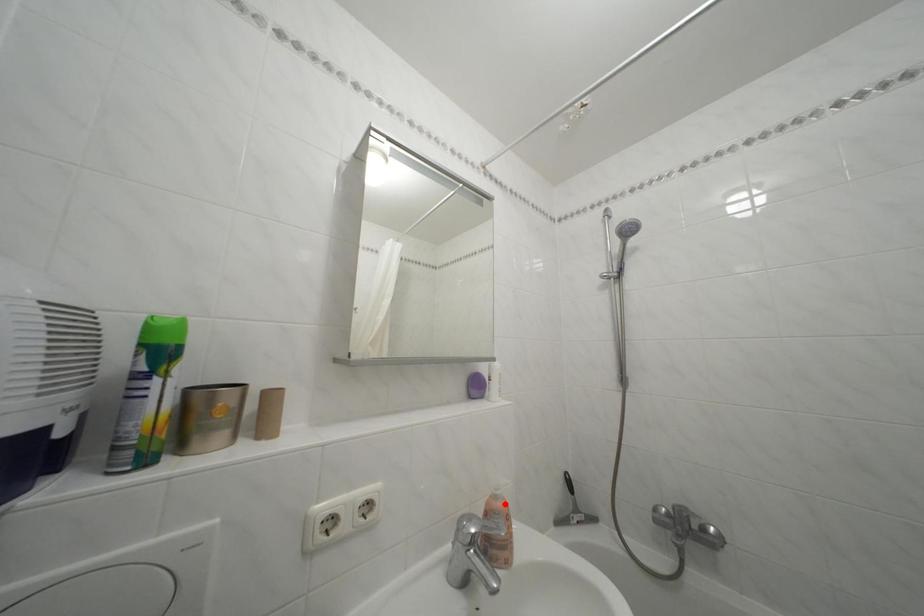
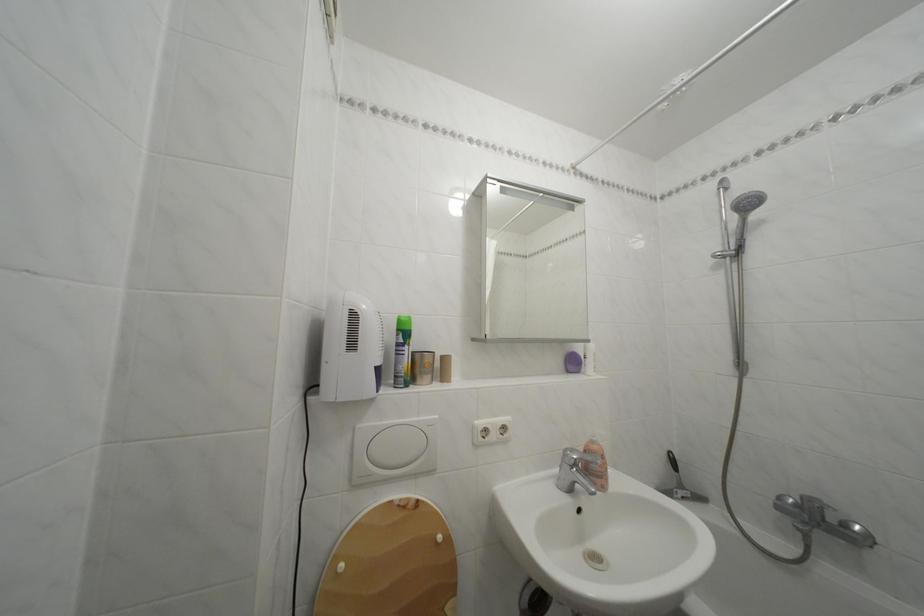
Locate, in the second image, the point that corresponds to the highlighted location in the first image.

(602, 448)